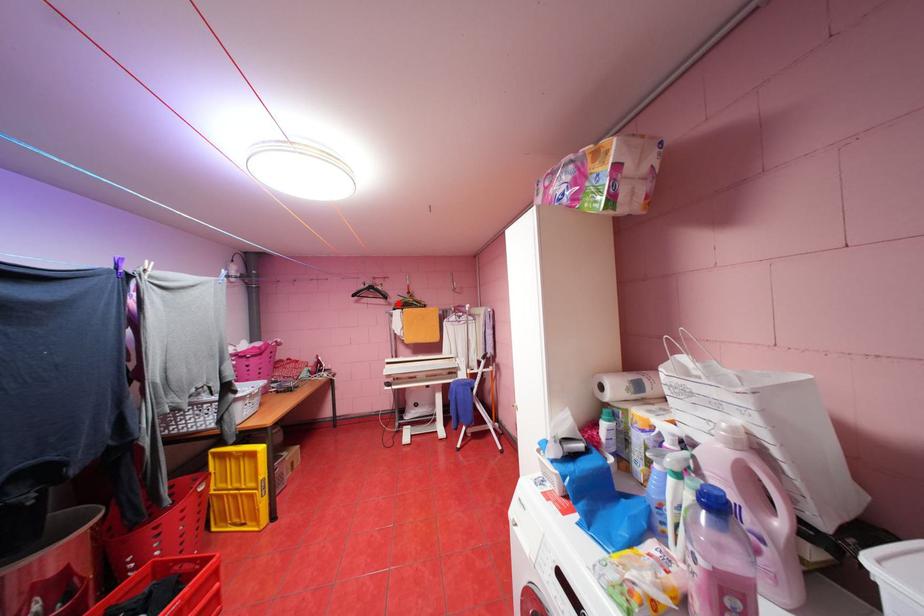
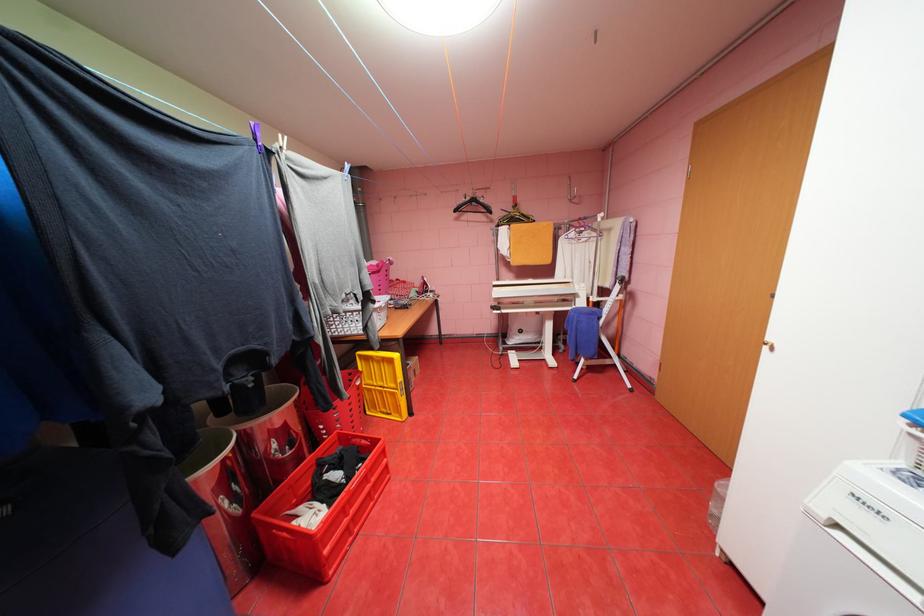
Question: I am providing you with two images of the same scene from different viewpoints. Given a red point in image1, look at the same physical point in image2. Is it:

Choices:
 (A) Closer to the viewpoint
 (B) Farther from the viewpoint

Answer: (A)